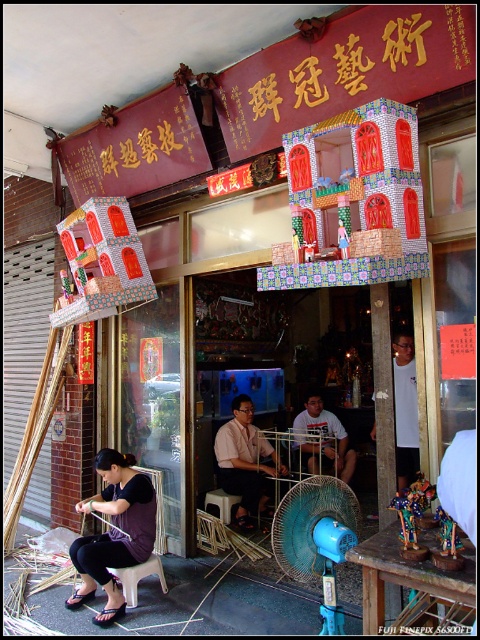
Between blue plastic mechanical fan at lower center and white cotton shirt at center, which one appears on the left side from the viewer's perspective?

Positioned to the left is blue plastic mechanical fan at lower center.

This screenshot has width=480, height=640. In order to click on blue plastic mechanical fan at lower center in this screenshot , I will do `click(316, 538)`.

Can you confirm if blue plastic mechanical fan at lower center is bigger than light brown shirt at center?

No, blue plastic mechanical fan at lower center is not bigger than light brown shirt at center.

Between point (286, 513) and point (256, 436), which one is positioned behind?

Positioned behind is point (256, 436).

This screenshot has width=480, height=640. I want to click on blue plastic mechanical fan at lower center, so click(x=316, y=538).

At what (x,y) coordinates should I click in order to perform the action: click on blue plastic mechanical fan at lower center. Please return your answer as a coordinate pair (x, y). The height and width of the screenshot is (640, 480). Looking at the image, I should click on (316, 538).

Is white cotton shirt at center below goldmetalsignboard at upper center?

No.

Is point (320, 410) farther from viewer compared to point (423, 628)?

Yes, point (320, 410) is farther from viewer.

The height and width of the screenshot is (640, 480). I want to click on white cotton shirt at center, so click(x=324, y=440).